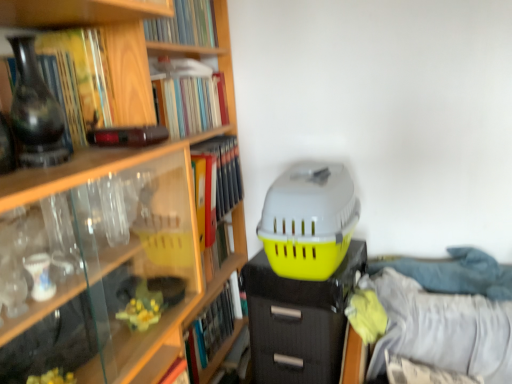
Question: From the image's perspective, does matte black file cabinet at center appear higher than hardcover book at lower left, which is the first book in bottom-to-top order?

Choices:
 (A) no
 (B) yes

Answer: (A)

Question: Is matte black file cabinet at center in front of hardcover book at lower left, which is the first book in bottom-to-top order?

Choices:
 (A) yes
 (B) no

Answer: (A)

Question: Can you confirm if matte black file cabinet at center is bigger than hardcover book at lower left, which is the first book in bottom-to-top order?

Choices:
 (A) yes
 (B) no

Answer: (A)

Question: Is matte black file cabinet at center facing towards hardcover book at lower left, which is the first book in bottom-to-top order?

Choices:
 (A) yes
 (B) no

Answer: (B)

Question: From the image's perspective, is matte black file cabinet at center beneath hardcover book at lower left, which is the first book in bottom-to-top order?

Choices:
 (A) no
 (B) yes

Answer: (B)

Question: From a real-world perspective, is yellow matte file folder at upper center, acting as the 3th book starting from the bottom, above or below matte black file cabinet at center?

Choices:
 (A) below
 (B) above

Answer: (B)

Question: Based on their sizes in the image, would you say yellow matte file folder at upper center, acting as the 3th book starting from the bottom, is bigger or smaller than matte black file cabinet at center?

Choices:
 (A) big
 (B) small

Answer: (B)

Question: Visually, is yellow matte file folder at upper center, placed as the 4th book when sorted from top to bottom, positioned to the left or to the right of matte black file cabinet at center?

Choices:
 (A) right
 (B) left

Answer: (B)

Question: Considering the positions of yellow matte file folder at upper center, placed as the 4th book when sorted from top to bottom, and matte black file cabinet at center in the image, is yellow matte file folder at upper center, placed as the 4th book when sorted from top to bottom, wider or thinner than matte black file cabinet at center?

Choices:
 (A) wide
 (B) thin

Answer: (B)

Question: From a real-world perspective, is hardcover book at lower left, which is the first book in bottom-to-top order, above or below hardcover book at upper center, the 6th book positioned from the bottom?

Choices:
 (A) below
 (B) above

Answer: (A)

Question: Based on their sizes in the image, would you say hardcover book at lower left, which is the first book in bottom-to-top order, is bigger or smaller than hardcover book at upper center, arranged as the 1th book when viewed from the top?

Choices:
 (A) small
 (B) big

Answer: (B)

Question: Is hardcover book at lower left, which is the first book in bottom-to-top order, in front of or behind hardcover book at upper center, arranged as the 1th book when viewed from the top, in the image?

Choices:
 (A) front
 (B) behind

Answer: (B)

Question: From the image's perspective, is hardcover book at lower left, marked as the 6th book in a top-to-bottom arrangement, above or below hardcover book at upper center, arranged as the 1th book when viewed from the top?

Choices:
 (A) above
 (B) below

Answer: (B)

Question: In terms of height, does hardcover book at upper center, the fifth book ordered from the bottom, look taller or shorter compared to matte black vase at left?

Choices:
 (A) tall
 (B) short

Answer: (B)

Question: Considering the positions of point (188, 102) and point (52, 155), is point (188, 102) closer or farther from the camera than point (52, 155)?

Choices:
 (A) farther
 (B) closer

Answer: (A)